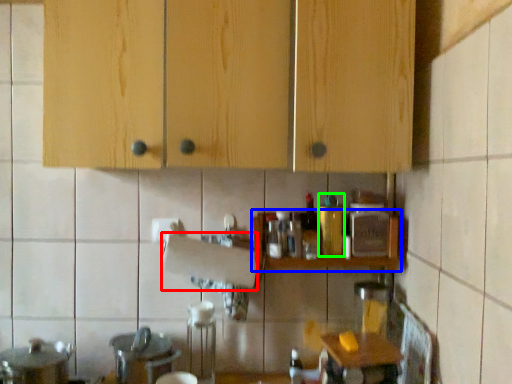
Question: Which is farther away from paper towel (highlighted by a red box)? shelf (highlighted by a blue box) or bottle (highlighted by a green box)?

Choices:
 (A) shelf
 (B) bottle

Answer: (B)